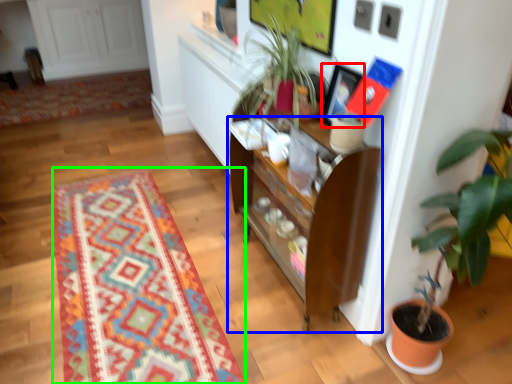
Question: Which object is positioned farthest from picture frame (highlighted by a red box)? Select from cabinetry (highlighted by a blue box) and mat (highlighted by a green box).

Choices:
 (A) cabinetry
 (B) mat

Answer: (B)